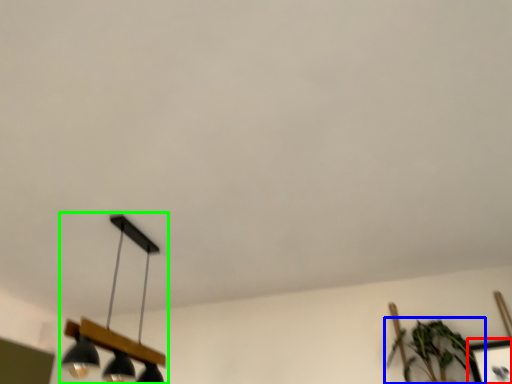
Question: Which object is the farthest from picture frame (highlighted by a red box)? Choose among these: houseplant (highlighted by a blue box) or lamp (highlighted by a green box).

Choices:
 (A) houseplant
 (B) lamp

Answer: (B)